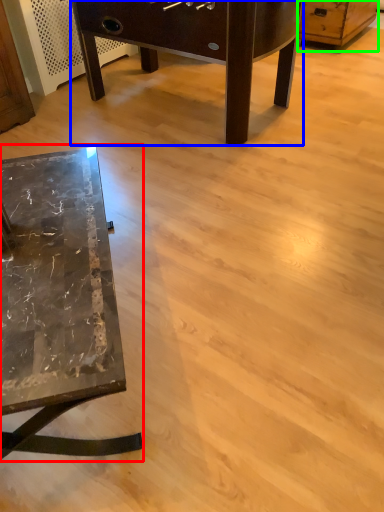
Question: Which object is the closest to the table (highlighted by a red box)? Choose among these: table (highlighted by a blue box) or dresser (highlighted by a green box).

Choices:
 (A) table
 (B) dresser

Answer: (A)